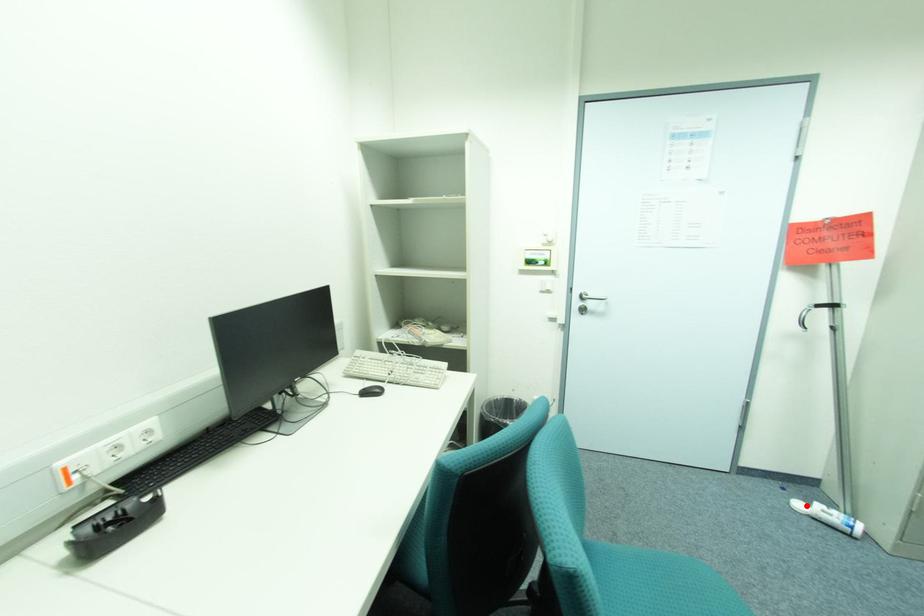
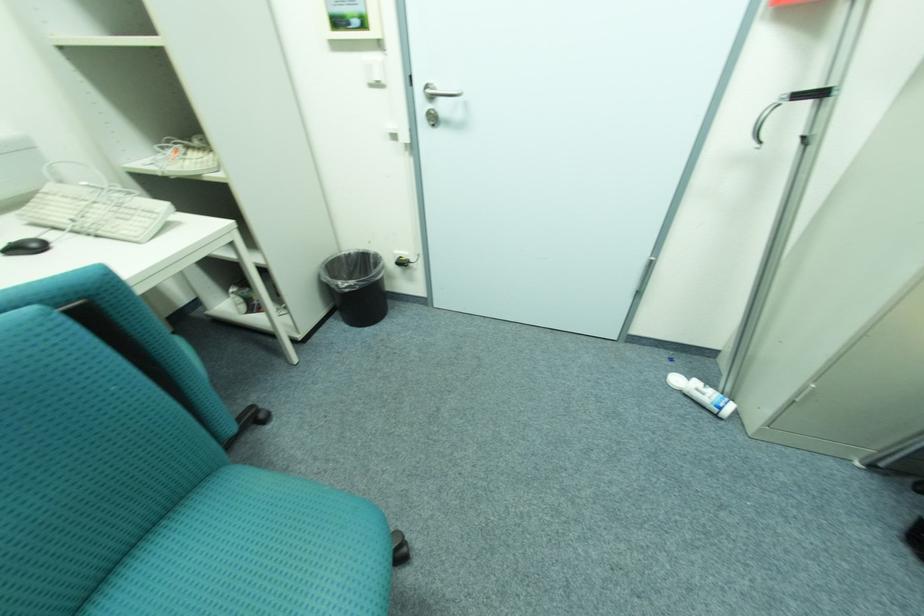
In the second image, find the point that corresponds to the highlighted location in the first image.

(683, 381)